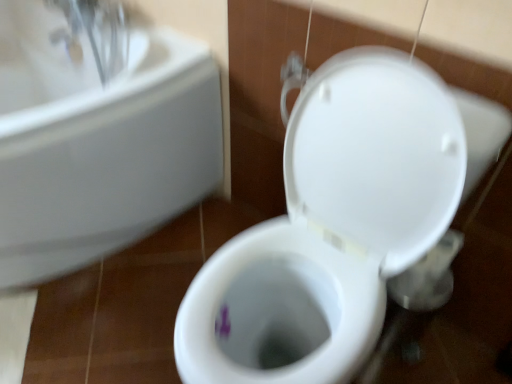
Question: From the image's perspective, would you say white glossy toilet at center is positioned over white ceramic sink at upper left?

Choices:
 (A) no
 (B) yes

Answer: (A)

Question: Can you confirm if white glossy toilet at center is bigger than white ceramic sink at upper left?

Choices:
 (A) no
 (B) yes

Answer: (A)

Question: Considering the relative sizes of white glossy toilet at center and white ceramic sink at upper left in the image provided, is white glossy toilet at center wider than white ceramic sink at upper left?

Choices:
 (A) yes
 (B) no

Answer: (B)

Question: Is the surface of white glossy toilet at center in direct contact with white ceramic sink at upper left?

Choices:
 (A) no
 (B) yes

Answer: (A)

Question: From a real-world perspective, is white glossy toilet at center physically above white ceramic sink at upper left?

Choices:
 (A) no
 (B) yes

Answer: (B)

Question: Is white glossy toilet at center further to the viewer compared to white ceramic sink at upper left?

Choices:
 (A) yes
 (B) no

Answer: (B)

Question: Can you confirm if white ceramic sink at upper left is thinner than white glossy toilet at center?

Choices:
 (A) no
 (B) yes

Answer: (A)

Question: Is white ceramic sink at upper left wider than white glossy toilet at center?

Choices:
 (A) no
 (B) yes

Answer: (B)

Question: Can you confirm if white ceramic sink at upper left is shorter than white glossy toilet at center?

Choices:
 (A) yes
 (B) no

Answer: (A)

Question: Is the position of white ceramic sink at upper left less distant than that of white glossy toilet at center?

Choices:
 (A) yes
 (B) no

Answer: (B)

Question: Is white ceramic sink at upper left not within white glossy toilet at center?

Choices:
 (A) yes
 (B) no

Answer: (A)

Question: From the image's perspective, would you say white ceramic sink at upper left is shown under white glossy toilet at center?

Choices:
 (A) no
 (B) yes

Answer: (A)

Question: From the image's perspective, is white ceramic sink at upper left above or below white glossy toilet at center?

Choices:
 (A) above
 (B) below

Answer: (A)